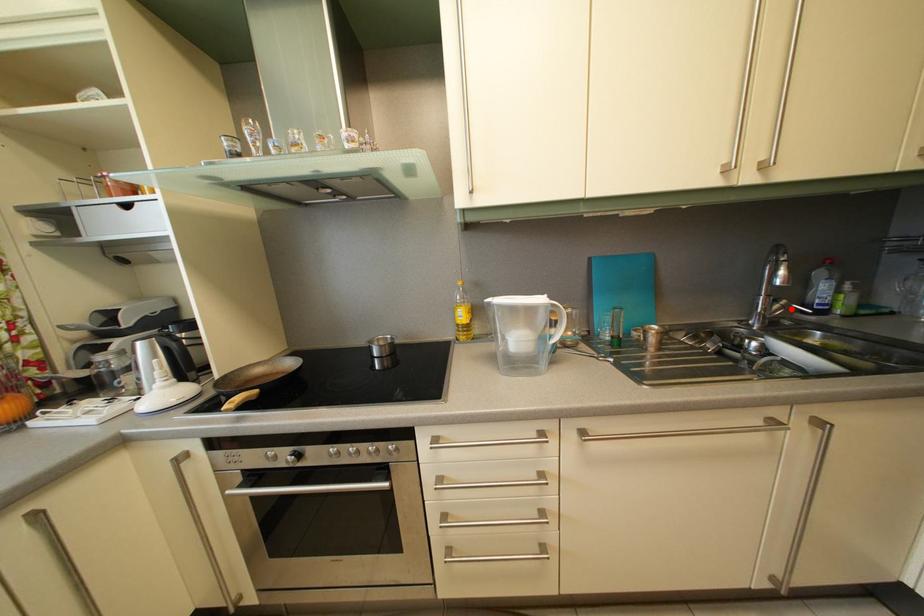
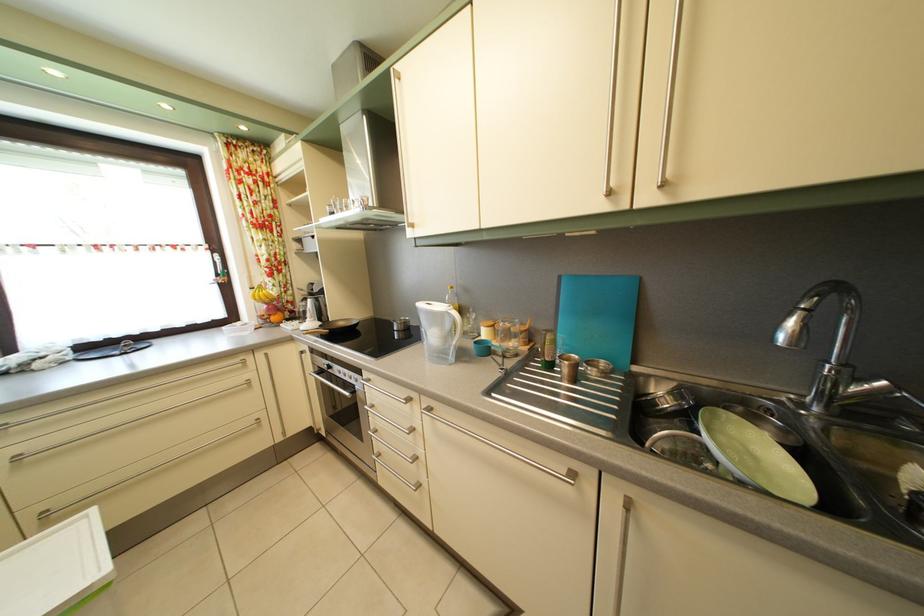
In the second image, find the point that corresponds to the highlighted location in the first image.

(893, 391)